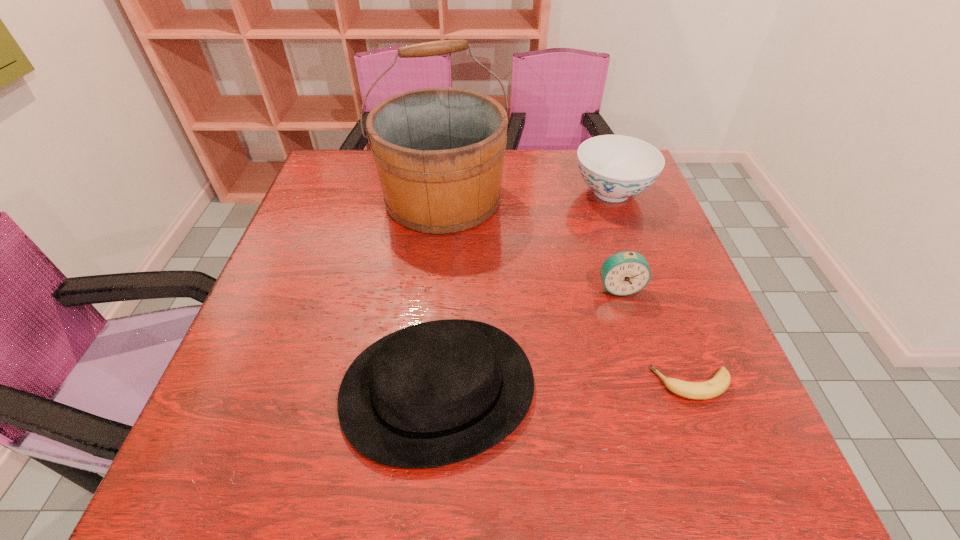
This screenshot has width=960, height=540. Identify the location of bucket. (439, 152).

I want to click on chinaware, so click(616, 167).

Identify the location of the third nearest object. (624, 273).

The height and width of the screenshot is (540, 960). I want to click on fedora, so click(436, 393).

Find the location of `the shortest object`. the shortest object is located at coordinates (714, 387).

Find the location of a particular element. The width and height of the screenshot is (960, 540). free region located on the right of the bucket is located at coordinates (564, 198).

The width and height of the screenshot is (960, 540). Find the location of `vacant space located 0.370m on the left of the chinaware`. vacant space located 0.370m on the left of the chinaware is located at coordinates (437, 192).

Locate an element on the screen. This screenshot has height=540, width=960. blank area located on the front-facing side of the alarm clock is located at coordinates tap(630, 324).

Locate an element on the screen. free space located 0.360m on the right of the fedora is located at coordinates (734, 389).

The width and height of the screenshot is (960, 540). I want to click on free space located at the stem of the banana, so click(604, 384).